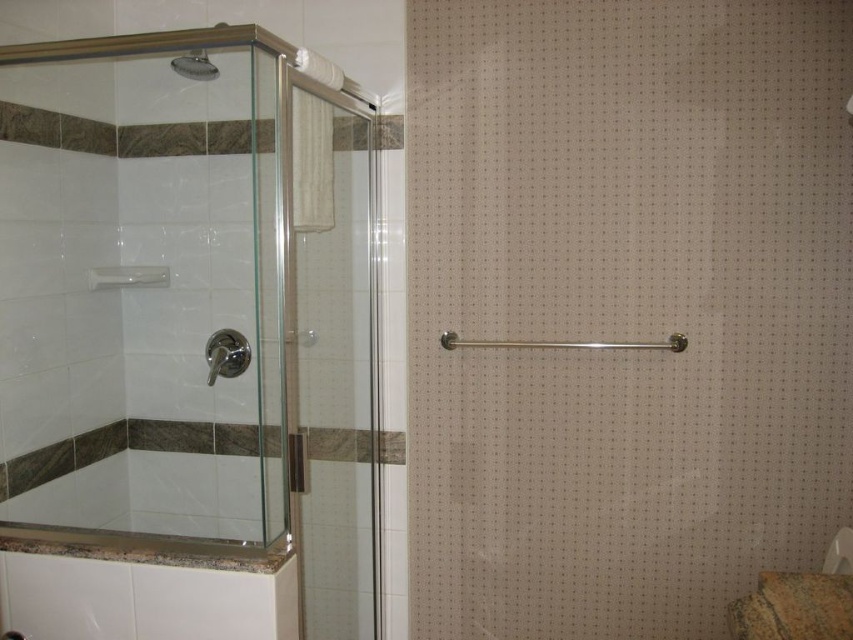
Can you confirm if brushed metal showerhead at left is positioned to the right of brushed metal shower head at upper left?

Yes, brushed metal showerhead at left is to the right of brushed metal shower head at upper left.

How much distance is there between brushed metal showerhead at left and brushed metal shower head at upper left?

The distance of brushed metal showerhead at left from brushed metal shower head at upper left is 65.45 centimeters.

Identify the location of brushed metal showerhead at left. (225, 355).

Is clear glass shower door at left further to camera compared to brown marble toilet bowl at lower right?

Yes, clear glass shower door at left is behind brown marble toilet bowl at lower right.

Can you confirm if clear glass shower door at left is positioned to the right of brown marble toilet bowl at lower right?

Incorrect, clear glass shower door at left is not on the right side of brown marble toilet bowl at lower right.

Does point (299, 356) come closer to viewer compared to point (751, 618)?

No, it is behind (751, 618).

Identify the location of clear glass shower door at left. (332, 362).

Identify the location of clear glass shower door at left. Image resolution: width=853 pixels, height=640 pixels. (332, 362).